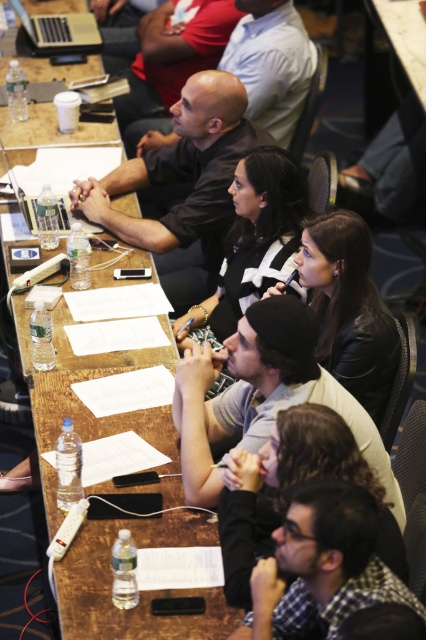
Question: Where is clear plastic water bottle at lower left located in relation to checkered fabric shirt at lower right in the image?

Choices:
 (A) above
 (B) below

Answer: (A)

Question: Estimate the real-world distances between objects in this image. Which object is farther from the matte black laptop at center?

Choices:
 (A) clear wood table at center
 (B) clear plastic water bottle at lower left

Answer: (B)

Question: Among these objects, which one is farthest from the camera?

Choices:
 (A) matte black laptop at center
 (B) clear wood table at center
 (C) clear plastic water bottle at lower left
 (D) checkered fabric shirt at lower right

Answer: (A)

Question: Which object is farther from the camera taking this photo?

Choices:
 (A) clear plastic water bottle at lower left
 (B) checkered fabric shirt at lower right
 (C) matte black laptop at center
 (D) clear wood table at center

Answer: (C)

Question: Does clear plastic water bottle at lower left appear under clear wood table at center?

Choices:
 (A) yes
 (B) no

Answer: (A)

Question: Does clear plastic water bottle at lower left appear on the right side of checkered fabric shirt at lower right?

Choices:
 (A) no
 (B) yes

Answer: (A)